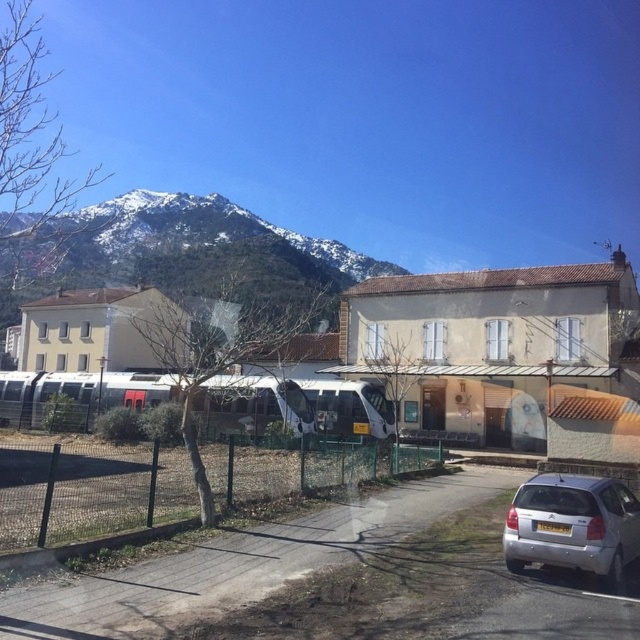
Which is below, snowy rock mountain at upper left or white glossy passenger train at center?

white glossy passenger train at center is below.

Does snowy rock mountain at upper left have a smaller size compared to white glossy passenger train at center?

No.

Image resolution: width=640 pixels, height=640 pixels. I want to click on snowy rock mountain at upper left, so click(x=188, y=252).

Between green wire mesh fence at center and white glossy passenger train at center, which one appears on the right side from the viewer's perspective?

From the viewer's perspective, green wire mesh fence at center appears more on the right side.

Is green wire mesh fence at center to the left of white glossy passenger train at center from the viewer's perspective?

No, green wire mesh fence at center is not to the left of white glossy passenger train at center.

Is point (8, 518) more distant than point (333, 419)?

No, it is not.

The width and height of the screenshot is (640, 640). I want to click on green wire mesh fence at center, so click(88, 492).

Can you confirm if snowy rock mountain at upper left is smaller than silver metallic hatchback at lower right?

Actually, snowy rock mountain at upper left might be larger than silver metallic hatchback at lower right.

Which is in front, point (93, 205) or point (595, 557)?

Point (595, 557) is in front.

Who is more forward, (269,276) or (508,556)?

Positioned in front is point (508,556).

Where is `snowy rock mountain at upper left`? The image size is (640, 640). snowy rock mountain at upper left is located at coordinates (188, 252).